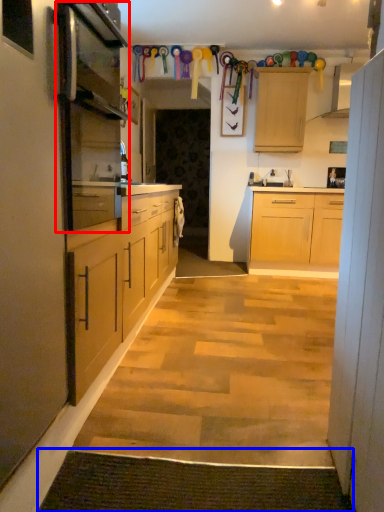
Question: Among these objects, which one is nearest to the camera, appliance (highlighted by a red box) or doormat (highlighted by a blue box)?

Choices:
 (A) appliance
 (B) doormat

Answer: (B)